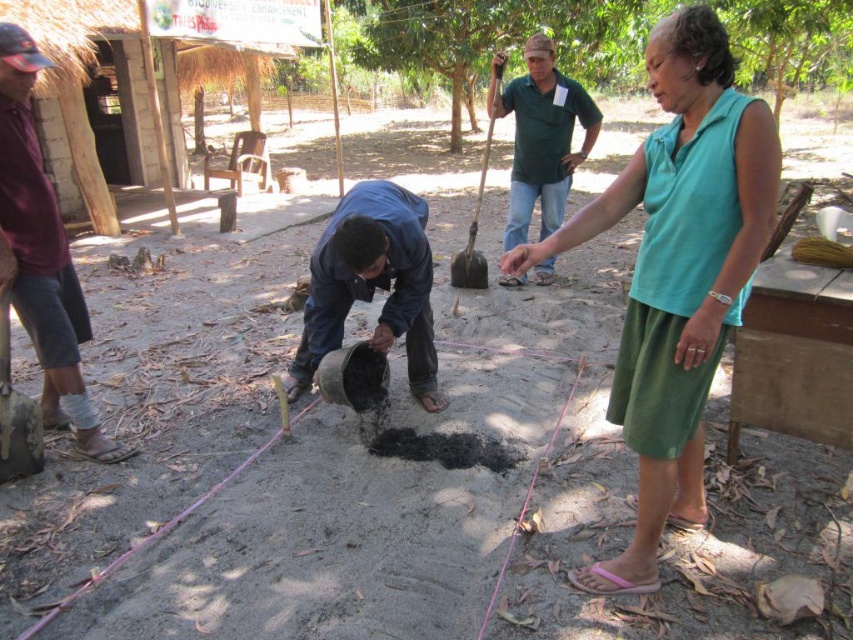
Question: Does black matte cement at center appear over dark blue fabric at center?

Choices:
 (A) yes
 (B) no

Answer: (B)

Question: Can you confirm if black matte cement at center is bigger than black soil at center?

Choices:
 (A) yes
 (B) no

Answer: (A)

Question: Estimate the real-world distances between objects in this image. Which object is closer to the maroon fabric shirt at left?

Choices:
 (A) black soil at center
 (B) teal fabric shirt at center

Answer: (A)

Question: Which point appears closest to the camera in this image?

Choices:
 (A) (245, 376)
 (B) (390, 301)

Answer: (B)

Question: Which of the following is the farthest from the observer?

Choices:
 (A) (704, 289)
 (B) (552, 186)
 (C) (440, 404)

Answer: (B)

Question: Is dark blue fabric at center positioned at the back of black soil at center?

Choices:
 (A) no
 (B) yes

Answer: (A)